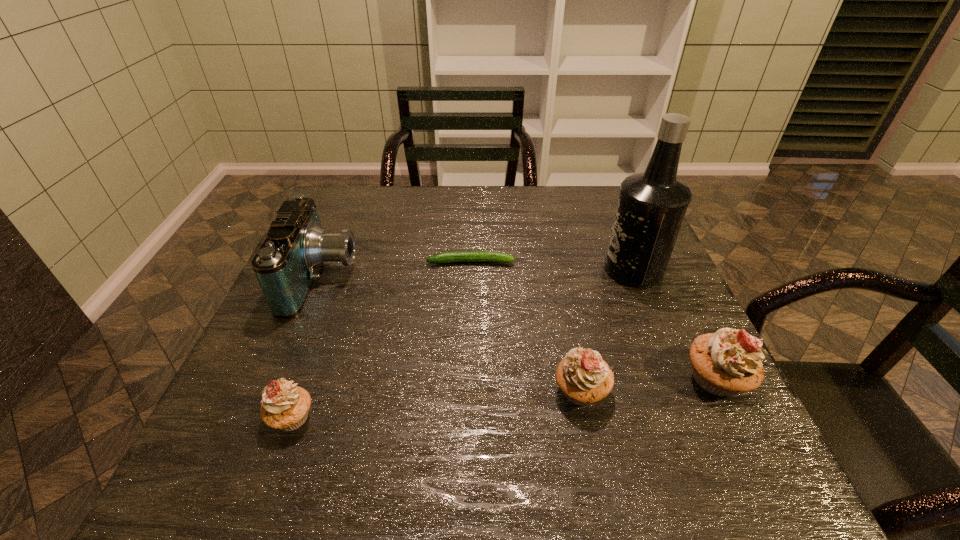
What are the coordinates of `spot to insert another cupcake for uniform distribution` in the screenshot? It's located at (440, 404).